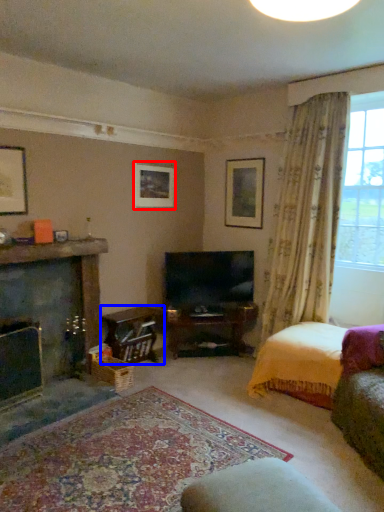
Question: Which point is further to the camera, picture frame (highlighted by a red box) or table (highlighted by a blue box)?

Choices:
 (A) picture frame
 (B) table

Answer: (A)